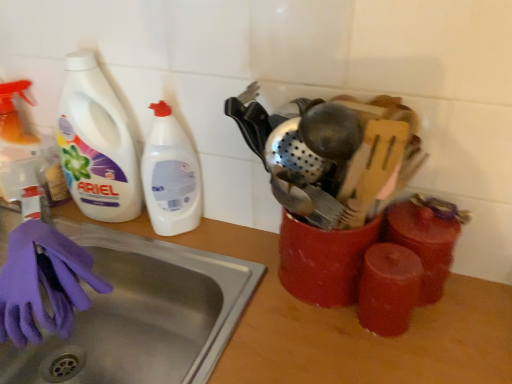
Question: From a real-world perspective, is wooden counter top at center under purple rubber glove at lower left?

Choices:
 (A) yes
 (B) no

Answer: (A)

Question: Is wooden counter top at center positioned behind purple rubber glove at lower left?

Choices:
 (A) yes
 (B) no

Answer: (B)

Question: Would you say wooden counter top at center is outside purple rubber glove at lower left?

Choices:
 (A) yes
 (B) no

Answer: (A)

Question: Considering the relative sizes of wooden counter top at center and purple rubber glove at lower left in the image provided, is wooden counter top at center wider than purple rubber glove at lower left?

Choices:
 (A) yes
 (B) no

Answer: (A)

Question: Can you confirm if wooden counter top at center is shorter than purple rubber glove at lower left?

Choices:
 (A) no
 (B) yes

Answer: (A)

Question: In terms of width, does stainless steel sink at lower left look wider or thinner when compared to white plastic bottle at left?

Choices:
 (A) wide
 (B) thin

Answer: (A)

Question: Based on their sizes in the image, would you say stainless steel sink at lower left is bigger or smaller than white plastic bottle at left?

Choices:
 (A) big
 (B) small

Answer: (A)

Question: Do you think stainless steel sink at lower left is within white plastic bottle at left, or outside of it?

Choices:
 (A) inside
 (B) outside

Answer: (B)

Question: Is stainless steel sink at lower left taller or shorter than white plastic bottle at left?

Choices:
 (A) tall
 (B) short

Answer: (B)

Question: Would you say wooden counter top at center is inside or outside white plastic bottle at left?

Choices:
 (A) inside
 (B) outside

Answer: (B)

Question: Is point (238, 379) positioned closer to the camera than point (153, 162)?

Choices:
 (A) closer
 (B) farther

Answer: (A)

Question: Considering their positions, is wooden counter top at center located in front of or behind white plastic bottle at left?

Choices:
 (A) front
 (B) behind

Answer: (A)

Question: In terms of width, does wooden counter top at center look wider or thinner when compared to white plastic bottle at left?

Choices:
 (A) wide
 (B) thin

Answer: (A)

Question: Based on their sizes in the image, would you say purple rubber glove at lower left is bigger or smaller than white plastic bottle at left?

Choices:
 (A) small
 (B) big

Answer: (B)

Question: From their relative heights in the image, would you say purple rubber glove at lower left is taller or shorter than white plastic bottle at left?

Choices:
 (A) short
 (B) tall

Answer: (A)